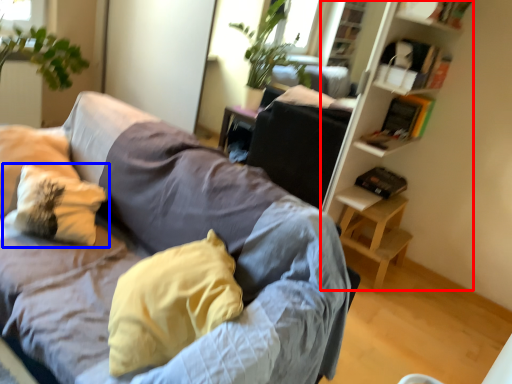
Question: Among these objects, which one is nearest to the camera, bookshelf (highlighted by a red box) or pillow (highlighted by a blue box)?

Choices:
 (A) bookshelf
 (B) pillow

Answer: (B)